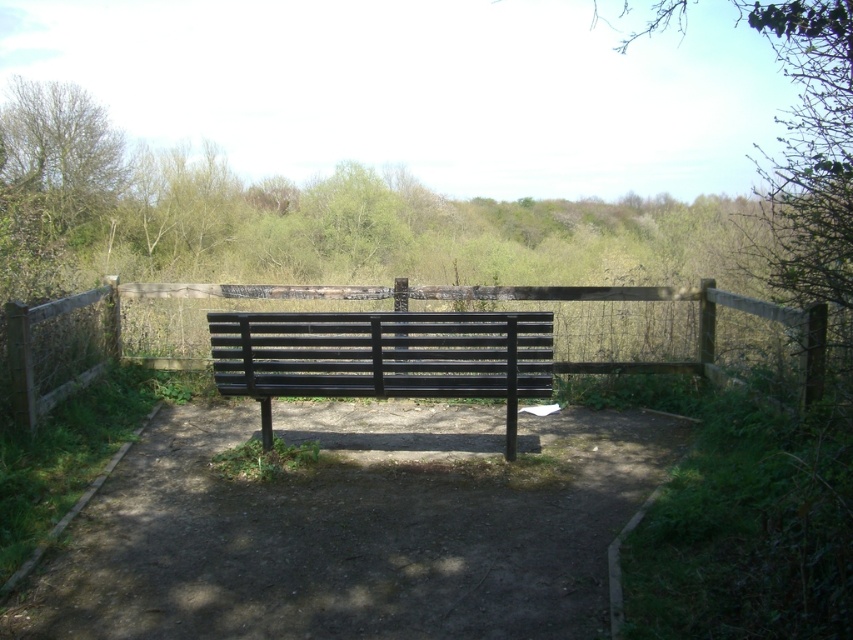
Question: Which of the following is the farthest from the observer?

Choices:
 (A) (486, 312)
 (B) (68, 308)
 (C) (300, 544)

Answer: (B)

Question: Which object is farther from the camera taking this photo?

Choices:
 (A) dirt path at center
 (B) wooden fence at center

Answer: (B)

Question: Is black metal bench at center to the left of green leafy tree at upper left from the viewer's perspective?

Choices:
 (A) no
 (B) yes

Answer: (A)

Question: Can you confirm if dirt path at center is positioned below green leafy tree at upper left?

Choices:
 (A) no
 (B) yes

Answer: (B)

Question: Which object appears farthest from the camera in this image?

Choices:
 (A) dirt path at center
 (B) green leafy tree at upper left
 (C) wooden fence at center
 (D) black metal bench at center

Answer: (B)

Question: Can you confirm if dirt path at center is smaller than green leafy tree at upper left?

Choices:
 (A) no
 (B) yes

Answer: (B)